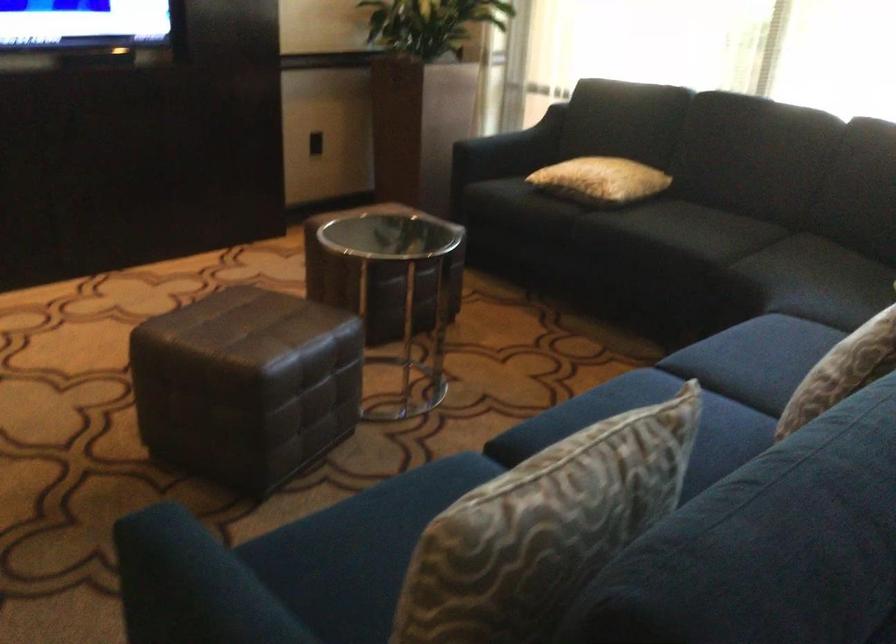
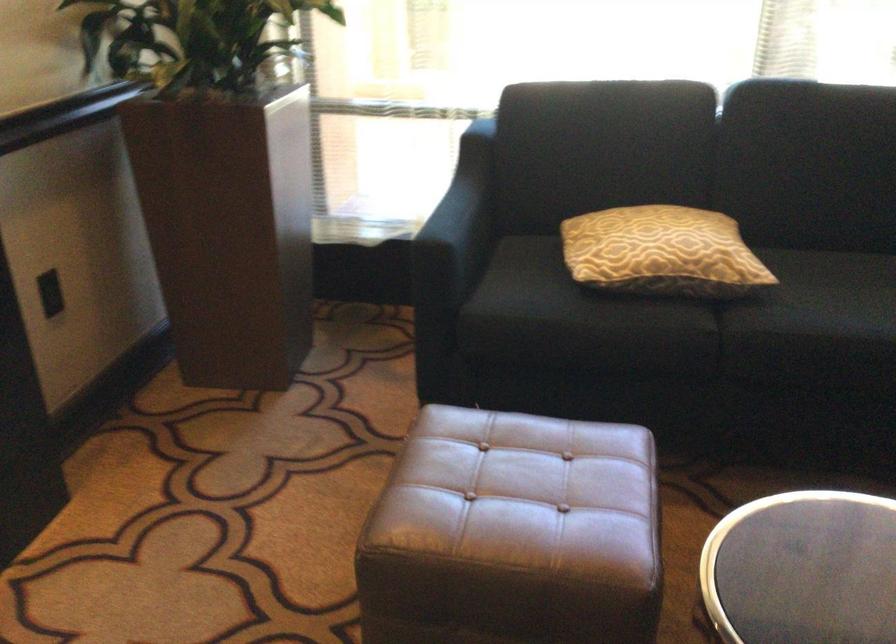
Where in the second image is the point corresponding to (x=488, y=140) from the first image?

(458, 225)